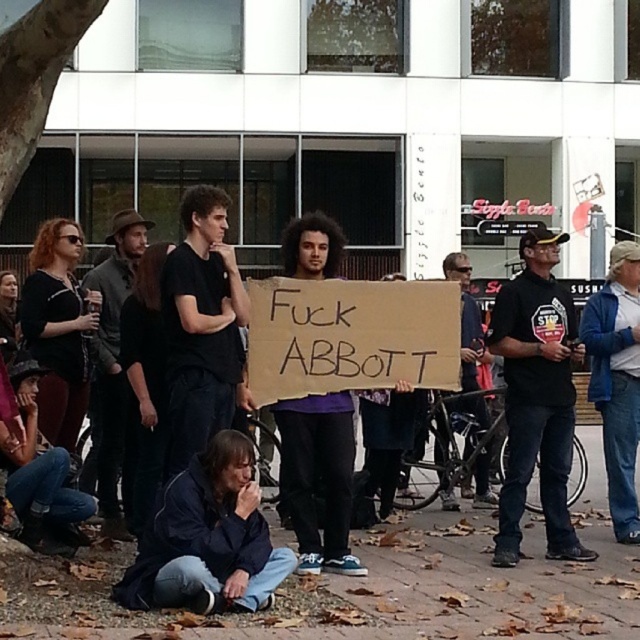
Measure the distance between cardboard sign at center and matte black t-shirt at center.

6.09 feet

Looking at this image, is cardboard sign at center smaller than matte black t-shirt at center?

Yes.

Is point (611, 561) farther from camera compared to point (461, 307)?

No, it is not.

This screenshot has height=640, width=640. I want to click on cardboard sign at center, so click(x=484, y=573).

From the picture: Between black t-shirt at center and matte black t-shirt at center, which one appears on the left side from the viewer's perspective?

From the viewer's perspective, matte black t-shirt at center appears more on the left side.

Can you confirm if black t-shirt at center is shorter than matte black t-shirt at center?

Yes.

Which is in front, point (554, 544) or point (467, 364)?

Point (554, 544)

Image resolution: width=640 pixels, height=640 pixels. In order to click on black t-shirt at center in this screenshot , I will do `click(536, 396)`.

Which of these two, black t-shirt at center or dark blue shirt at left, stands shorter?

black t-shirt at center

Can you confirm if black t-shirt at center is smaller than dark blue shirt at left?

Incorrect, black t-shirt at center is not smaller in size than dark blue shirt at left.

Describe the element at coordinates (536, 396) in the screenshot. The image size is (640, 640). I see `black t-shirt at center` at that location.

Where is `black t-shirt at center`? The width and height of the screenshot is (640, 640). black t-shirt at center is located at coordinates (536, 396).